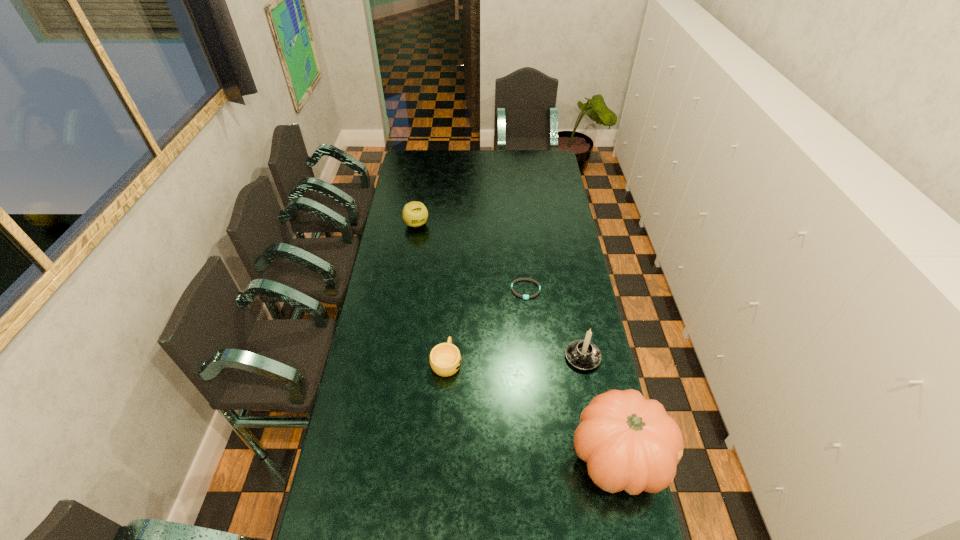
I want to click on cup, so click(445, 359).

Where is `the fourth object from right to left`? The image size is (960, 540). the fourth object from right to left is located at coordinates (445, 359).

Locate an element on the screen. This screenshot has width=960, height=540. pumpkin is located at coordinates (630, 443).

Identify the location of the nearest object. pyautogui.click(x=630, y=443).

Where is `the second farthest object`? the second farthest object is located at coordinates (522, 296).

Identify the location of the third object from right to left. (522, 296).

Identify the location of the third tallest object. (415, 214).

Where is `the leftmost object`? the leftmost object is located at coordinates (415, 214).

You are a GUI agent. You are given a task and a screenshot of the screen. Output one action in this format:
    pyautogui.click(x=<x>, y=<y>)
    Task: Click on the fourth shortest object
    
    Given the screenshot: What is the action you would take?
    pyautogui.click(x=582, y=354)

This screenshot has height=540, width=960. What are the coordinates of `free spot located 0.370m on the front of the fourth tallest object` in the screenshot? It's located at (439, 485).